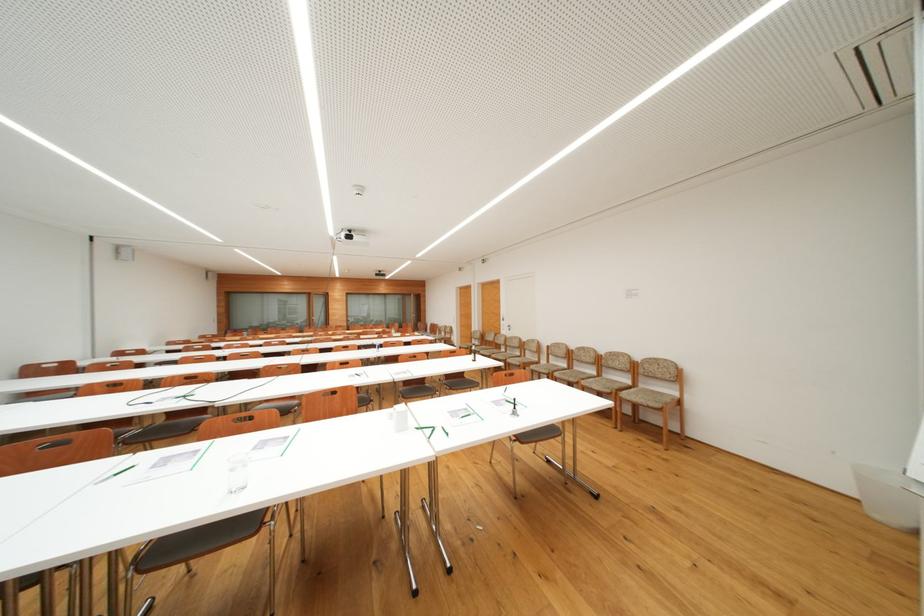
Which object does [886,496] point to?

This point indicates the white trash can.